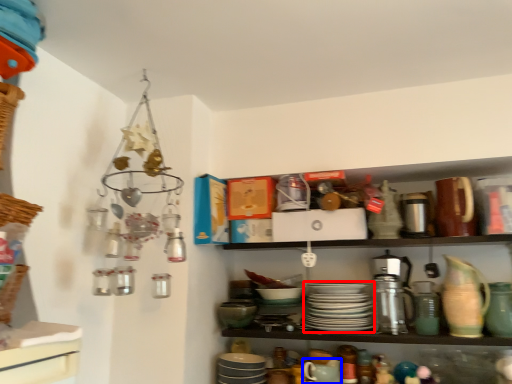
Question: Which object is further to the camera taking this photo, tableware (highlighted by a red box) or tableware (highlighted by a blue box)?

Choices:
 (A) tableware
 (B) tableware

Answer: (A)